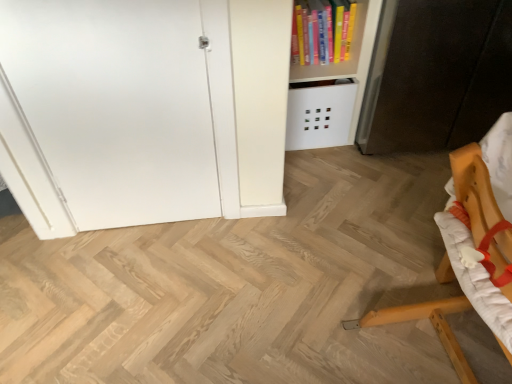
Describe the element at coordinates (474, 191) in the screenshot. I see `wooden chair at lower right` at that location.

The height and width of the screenshot is (384, 512). I want to click on hardcover book at upper right, so click(322, 31).

Describe the element at coordinates (118, 111) in the screenshot. The width and height of the screenshot is (512, 384). I see `white matte door at left` at that location.

Image resolution: width=512 pixels, height=384 pixels. What are the coordinates of `wooden chair at lower right` in the screenshot? It's located at (474, 191).

Which is more distant, (293, 31) or (16, 149)?

The point (293, 31) is behind.

Is hardcover book at upper right oriented towards white matte door at left?

No, hardcover book at upper right does not turn towards white matte door at left.

Is hardcover book at upper right bigger or smaller than white matte door at left?

In the image, hardcover book at upper right appears to be smaller than white matte door at left.

Does wooden chair at lower right have a smaller size compared to dark brown wood cabinet at right?

Yes.

Is point (477, 244) closer or farther from the camera than point (445, 2)?

Point (477, 244).

Consider the image. Is wooden chair at lower right positioned beyond the bounds of dark brown wood cabinet at right?

Absolutely, wooden chair at lower right is external to dark brown wood cabinet at right.

Which of these two, wooden chair at lower right or dark brown wood cabinet at right, is wider?

dark brown wood cabinet at right is wider.

Between white matte door at left and wooden chair at lower right, which one has larger width?

wooden chair at lower right.

Looking at this image, in the image, is white matte door at left positioned in front of or behind wooden chair at lower right?

white matte door at left is positioned farther from the viewer than wooden chair at lower right.

Between white matte door at left and wooden chair at lower right, which one has more height?

white matte door at left.

Could you tell me if dark brown wood cabinet at right is facing white matte door at left?

No, dark brown wood cabinet at right is not turned towards white matte door at left.

Can white matte door at left be found inside dark brown wood cabinet at right?

No.

Considering the relative positions of dark brown wood cabinet at right and white matte door at left in the image provided, is dark brown wood cabinet at right behind white matte door at left?

Yes, dark brown wood cabinet at right is further from the viewer.

Considering the positions of objects dark brown wood cabinet at right and white matte door at left in the image provided, who is more to the right, dark brown wood cabinet at right or white matte door at left?

Positioned to the right is dark brown wood cabinet at right.

Is the position of hardcover book at upper right more distant than that of wooden chair at lower right?

That is True.

Does hardcover book at upper right turn towards wooden chair at lower right?

Yes, hardcover book at upper right is aimed at wooden chair at lower right.

Considering the positions of points (329, 43) and (448, 353), is point (329, 43) closer to camera compared to point (448, 353)?

That is False.

Is hardcover book at upper right touching wooden chair at lower right?

hardcover book at upper right is not next to wooden chair at lower right, and they're not touching.

Considering the sizes of objects white matte door at left and dark brown wood cabinet at right in the image provided, who is taller, white matte door at left or dark brown wood cabinet at right?

white matte door at left is taller.

How different are the orientations of white matte door at left and dark brown wood cabinet at right in degrees?

They differ by 7.24e-05 degrees in their facing directions.

Looking at this image, are white matte door at left and dark brown wood cabinet at right making contact?

No, white matte door at left is not making contact with dark brown wood cabinet at right.

Locate an element on the screen. door on the left of dark brown wood cabinet at right is located at coordinates (118, 111).

In the scene shown: Between white matte door at left and hardcover book at upper right, which one has larger width?

Wider between the two is hardcover book at upper right.

Is white matte door at left in contact with hardcover book at upper right?

No.

Based on their sizes in the image, would you say white matte door at left is bigger or smaller than hardcover book at upper right?

Considering their sizes, white matte door at left takes up more space than hardcover book at upper right.

From a real-world perspective, is white matte door at left beneath hardcover book at upper right?

Yes, from a real-world perspective, white matte door at left is below hardcover book at upper right.

At what (x,y) coordinates should I click in order to perform the action: click on book located behind the white matte door at left. Please return your answer as a coordinate pair (x, y). The width and height of the screenshot is (512, 384). Looking at the image, I should click on (322, 31).

The width and height of the screenshot is (512, 384). In order to click on cabinetry to the right of wooden chair at lower right in this screenshot , I will do `click(437, 75)`.

Based on their spatial positions, is hardcover book at upper right or white matte door at left further from dark brown wood cabinet at right?

white matte door at left.

Estimate the real-world distances between objects in this image. Which object is closer to wooden chair at lower right, hardcover book at upper right or dark brown wood cabinet at right?

dark brown wood cabinet at right is positioned closer to the anchor wooden chair at lower right.

When comparing their distances from dark brown wood cabinet at right, does wooden chair at lower right or white matte door at left seem closer?

Among the two, wooden chair at lower right is located nearer to dark brown wood cabinet at right.

Considering their positions, is white matte door at left positioned closer to hardcover book at upper right than dark brown wood cabinet at right?

dark brown wood cabinet at right.

Looking at the image, which one is located further to white matte door at left, hardcover book at upper right or dark brown wood cabinet at right?

Among the two, dark brown wood cabinet at right is located further to white matte door at left.

Considering their positions, is wooden chair at lower right positioned further to white matte door at left than hardcover book at upper right?

wooden chair at lower right.

Estimate the real-world distances between objects in this image. Which object is closer to wooden chair at lower right, dark brown wood cabinet at right or white matte door at left?

dark brown wood cabinet at right is closer to wooden chair at lower right.

Which object lies nearer to the anchor point dark brown wood cabinet at right, white matte door at left or wooden chair at lower right?

The object closer to dark brown wood cabinet at right is wooden chair at lower right.

Identify the location of furniture located between white matte door at left and dark brown wood cabinet at right in the left-right direction. This screenshot has height=384, width=512. (474, 191).

At what (x,y) coordinates should I click in order to perform the action: click on book between white matte door at left and dark brown wood cabinet at right in the horizontal direction. Please return your answer as a coordinate pair (x, y). This screenshot has height=384, width=512. Looking at the image, I should click on (322, 31).

Find the location of a particular element. This screenshot has width=512, height=384. cabinetry between hardcover book at upper right and wooden chair at lower right in the up-down direction is located at coordinates (437, 75).

Where is `book between white matte door at left and wooden chair at lower right from left to right`? The image size is (512, 384). book between white matte door at left and wooden chair at lower right from left to right is located at coordinates (322, 31).